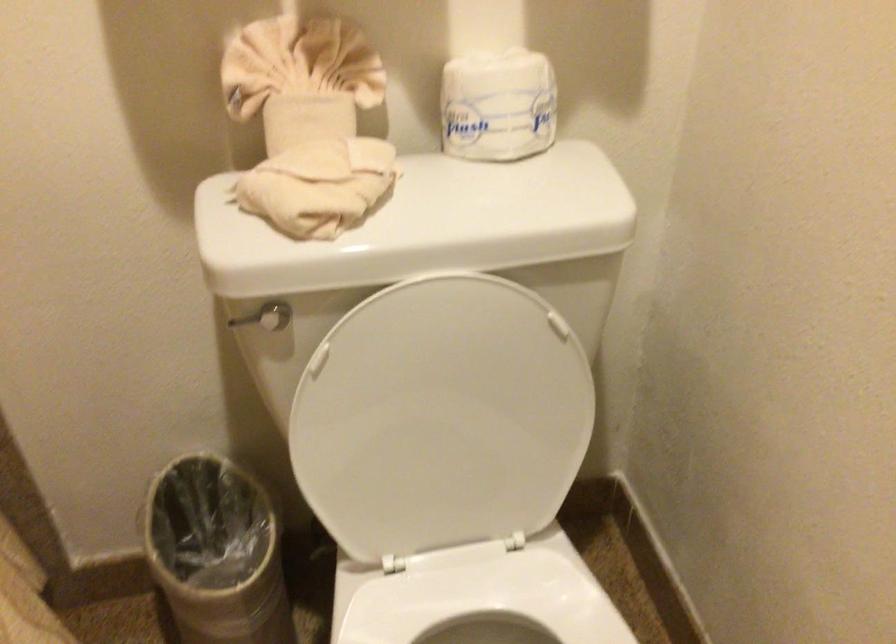
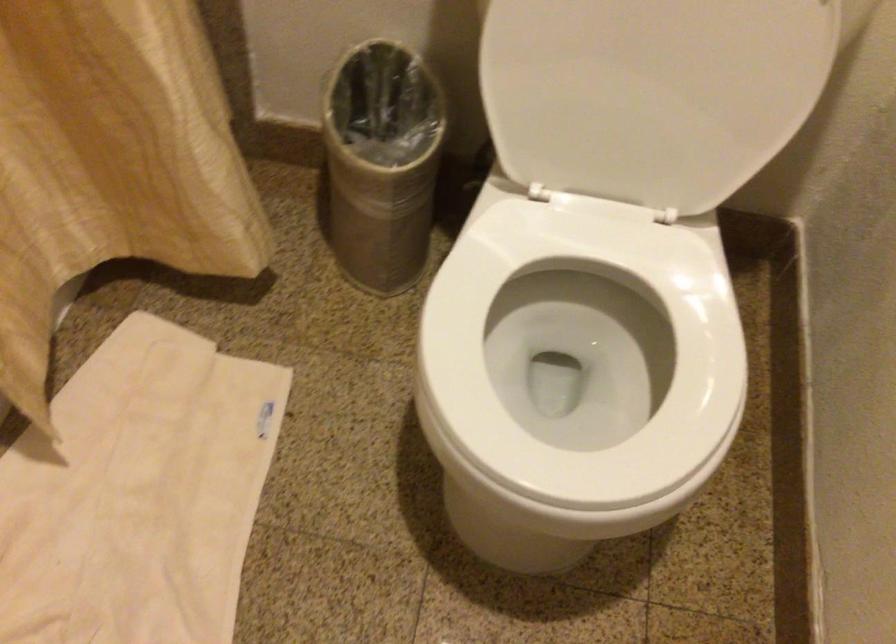
Question: How did the camera likely rotate?

Choices:
 (A) Left
 (B) Right
 (C) Up
 (D) Down

Answer: (D)